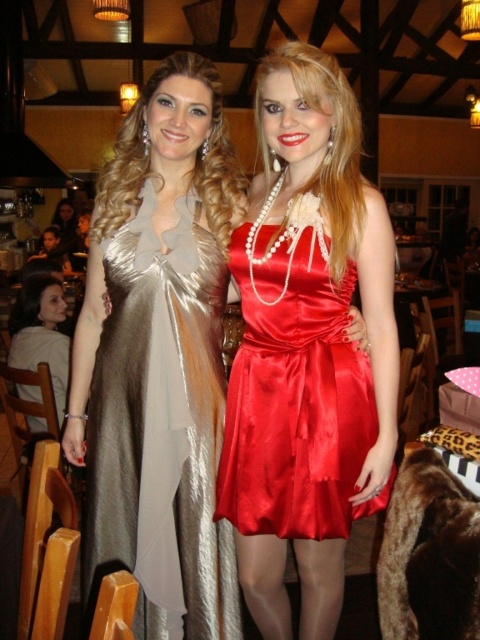
Is satin metallic dress at center below shiny red dress at center?

Yes.

Which is behind, point (112, 540) or point (322, 300)?

The point (112, 540) is behind.

Which is behind, point (156, 186) or point (356, 360)?

The point (156, 186) is behind.

Where is `satin metallic dress at center`? The width and height of the screenshot is (480, 640). satin metallic dress at center is located at coordinates (160, 428).